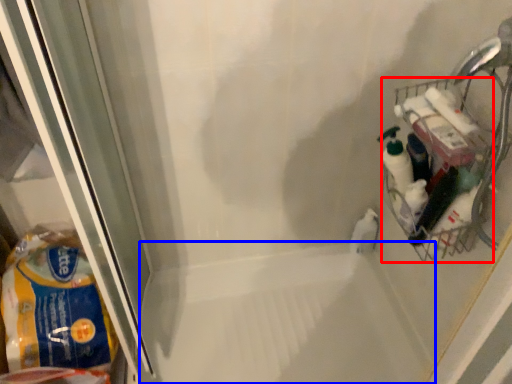
Question: Which of the following is the farthest to the observer, basket (highlighted by a red box) or bath (highlighted by a blue box)?

Choices:
 (A) basket
 (B) bath

Answer: (B)